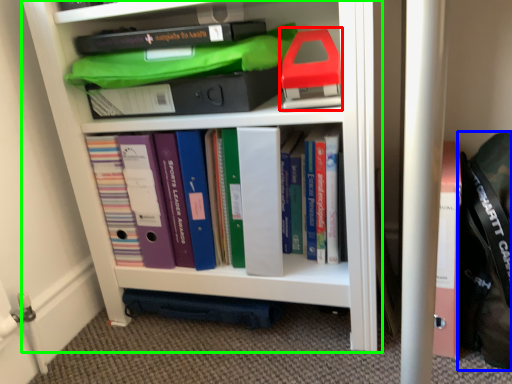
Question: Based on their relative distances, which object is nearer to book (highlighted by a red box)? Choose from messenger bag (highlighted by a blue box) and shelf (highlighted by a green box).

Choices:
 (A) messenger bag
 (B) shelf

Answer: (B)